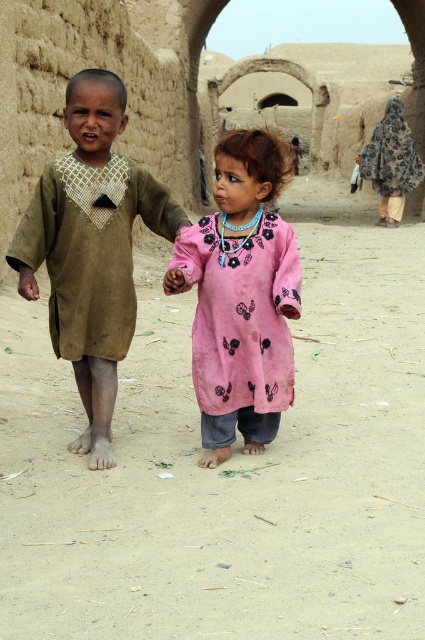
You are a photographer trying to capture a clear shot of the dusty brown ground at center and the pink fabric dress at center. Which object should you focus on first if you want to ensure both are in focus without adjusting the camera settings?

The dusty brown ground at center is much taller than the pink fabric dress at center, so focusing on the dusty brown ground at center first would help ensure both are in focus since it is farther away.

You are a photographer standing at the point marked as point [229,464]. You want to take a picture of the two children. Which direction should you face to capture both children in the frame?

Since point [229,464] is on dusty brown ground at center, you should face towards the direction where the two children are located to capture them in the frame.